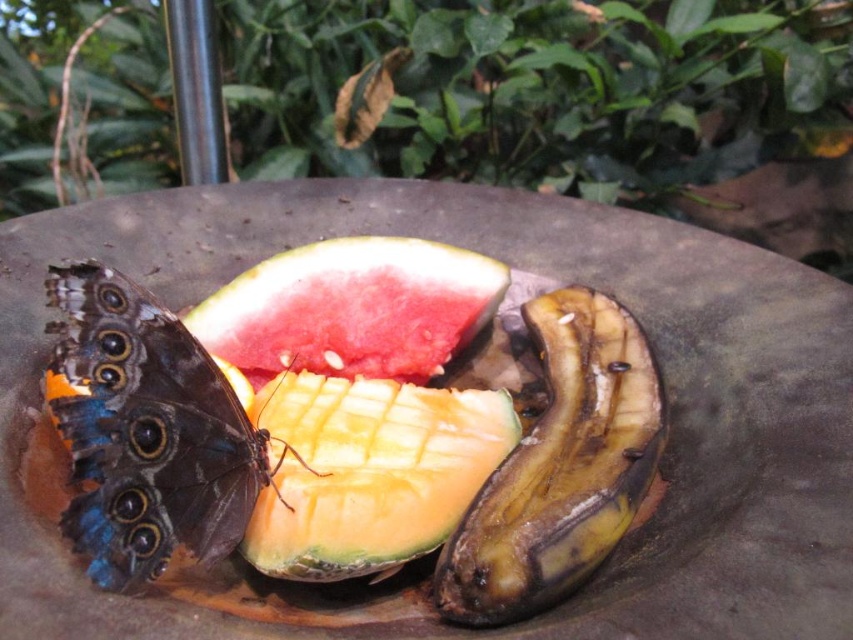
You are a chef preparing a fruit platter and notice the blue iridescent wings at lower left and the watermelon at center. Which object should you avoid using in your dish?

The blue iridescent wings at lower left should be avoided because they are part of a butterfly, which is not edible. The watermelon at center is safe to use.